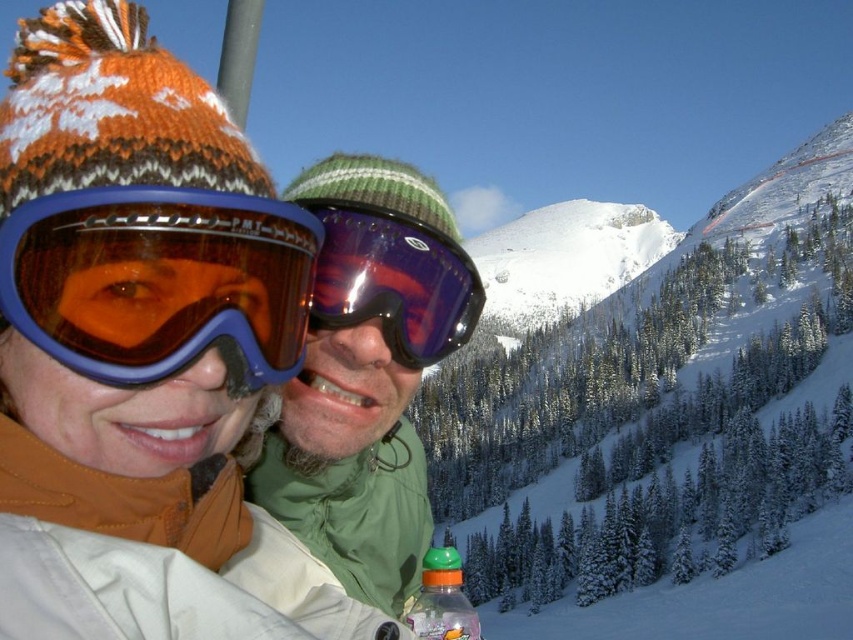
You are a photographer trying to capture a clear photo of the green matte jacket at center and the translucent plastic bottle at lower center. Which object will appear larger in your photo?

The green matte jacket at center will appear larger in the photo because it is closer to the viewer than the translucent plastic bottle at lower center.

You are standing in the snowy mountainous location and want to locate the matte orange knit hat at upper left. According to the coordinates provided, where should you look relative to the center of the image?

The matte orange knit hat at upper left is located at point [146,305], which means it is positioned to the left and slightly below the center of the image.